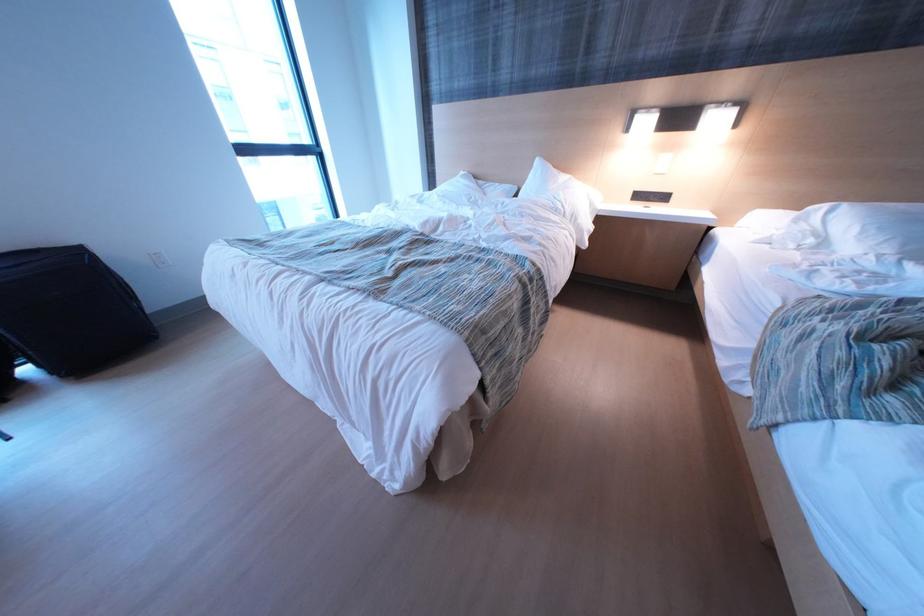
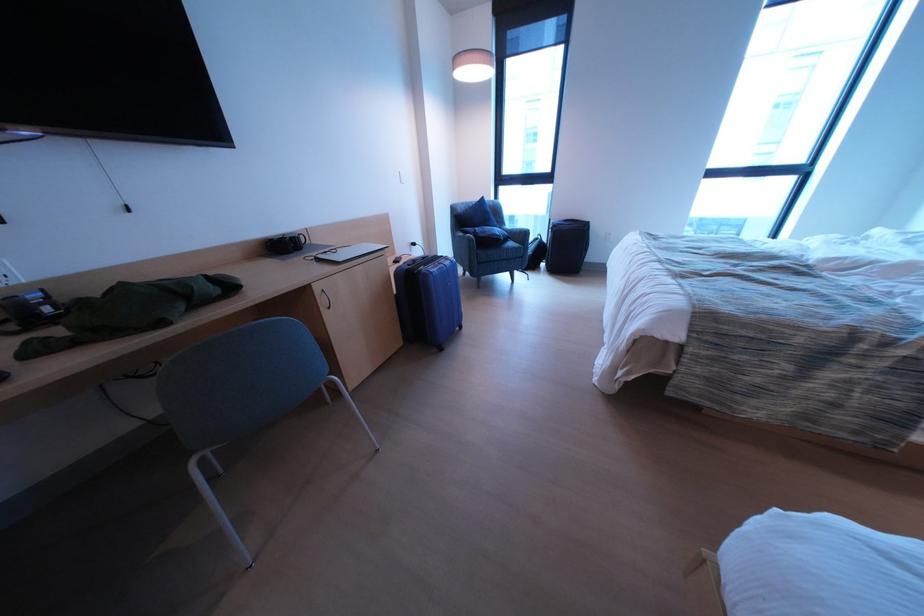
First-person continuous shooting, in which direction is the camera rotating?

The camera rotated toward left-down.